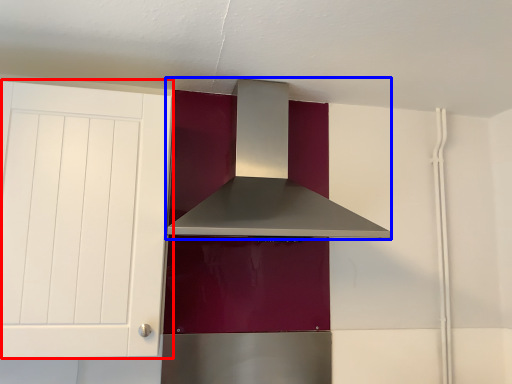
Question: Which object appears closest to the camera in this image, cabinetry (highlighted by a red box) or home appliance (highlighted by a blue box)?

Choices:
 (A) cabinetry
 (B) home appliance

Answer: (A)